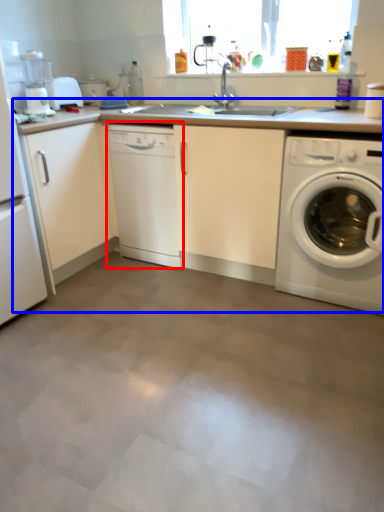
Question: Which object appears closest to the camera in this image, dish washer (highlighted by a red box) or counter top (highlighted by a blue box)?

Choices:
 (A) dish washer
 (B) counter top

Answer: (B)